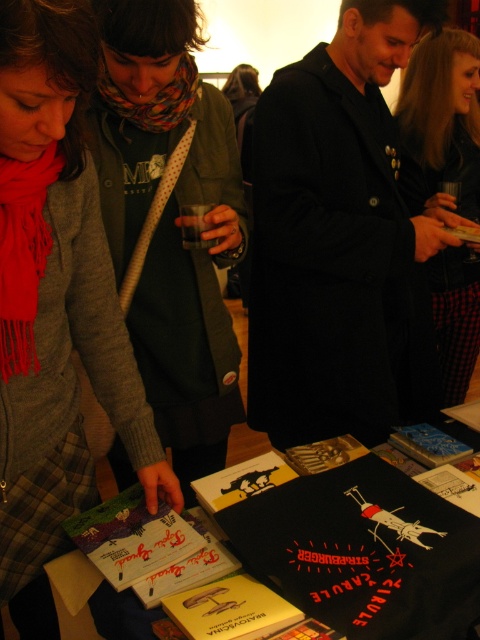
Question: Does black wool coat at center appear over yellow paper book at center?

Choices:
 (A) no
 (B) yes

Answer: (B)

Question: Where is black leather jacket at upper right located in relation to red silk scarf at left in the image?

Choices:
 (A) right
 (B) left

Answer: (A)

Question: Which point is closer to the camera?

Choices:
 (A) (402, 164)
 (B) (171, 99)

Answer: (B)

Question: Does multicolored scarf at center appear on the right side of black leather jacket at upper right?

Choices:
 (A) no
 (B) yes

Answer: (A)

Question: Which of the following is the closest to the observer?

Choices:
 (A) (471, 284)
 (B) (187, 106)
 (C) (216, 582)

Answer: (C)

Question: Considering the real-world distances, which object is closest to the black wool coat at center?

Choices:
 (A) matte gray scarf at lower left
 (B) black leather jacket at upper right
 (C) yellow paper book at center
 (D) black paper at center

Answer: (B)